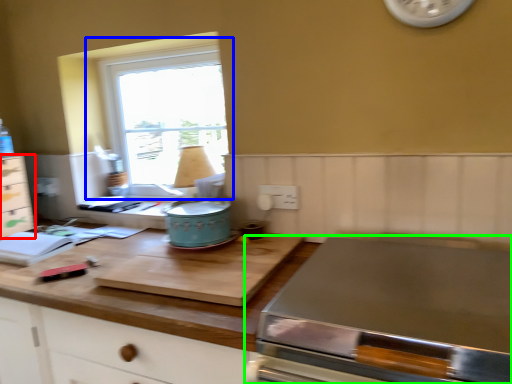
Question: Estimate the real-world distances between objects in this image. Which object is farther from cabinetry (highlighted by a red box), window (highlighted by a blue box) or home appliance (highlighted by a green box)?

Choices:
 (A) window
 (B) home appliance

Answer: (B)